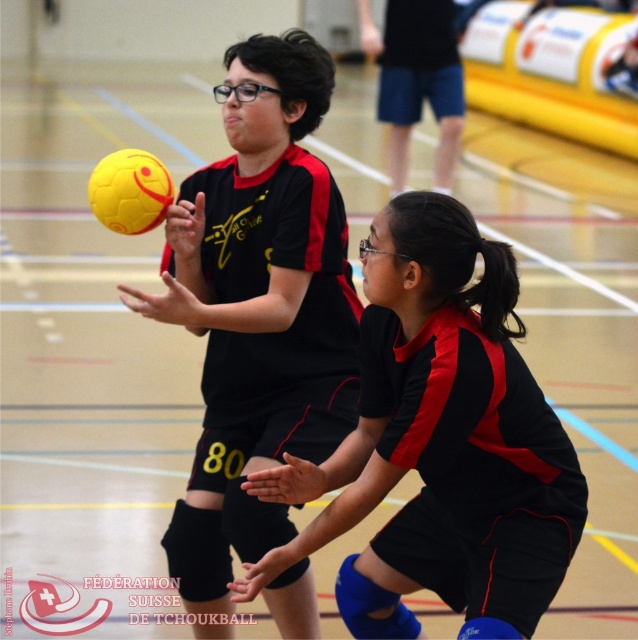
Question: Does black matte uniform at center appear over yellow matte volleyball at center?

Choices:
 (A) yes
 (B) no

Answer: (B)

Question: Which object is farther from the camera taking this photo?

Choices:
 (A) yellow matte ball at upper left
 (B) yellow matte volleyball at center
 (C) black matte uniform at center

Answer: (B)

Question: Does black matte uniform at center appear over yellow matte ball at upper left?

Choices:
 (A) yes
 (B) no

Answer: (B)

Question: Considering the real-world distances, which object is farthest from the yellow matte ball at upper left?

Choices:
 (A) black matte uniform at center
 (B) yellow matte volleyball at center

Answer: (B)

Question: Can you confirm if black matte uniform at center is bigger than yellow matte ball at upper left?

Choices:
 (A) no
 (B) yes

Answer: (A)

Question: Which point is farther to the camera?

Choices:
 (A) (225, 452)
 (B) (135, 157)
 (C) (401, 388)

Answer: (A)